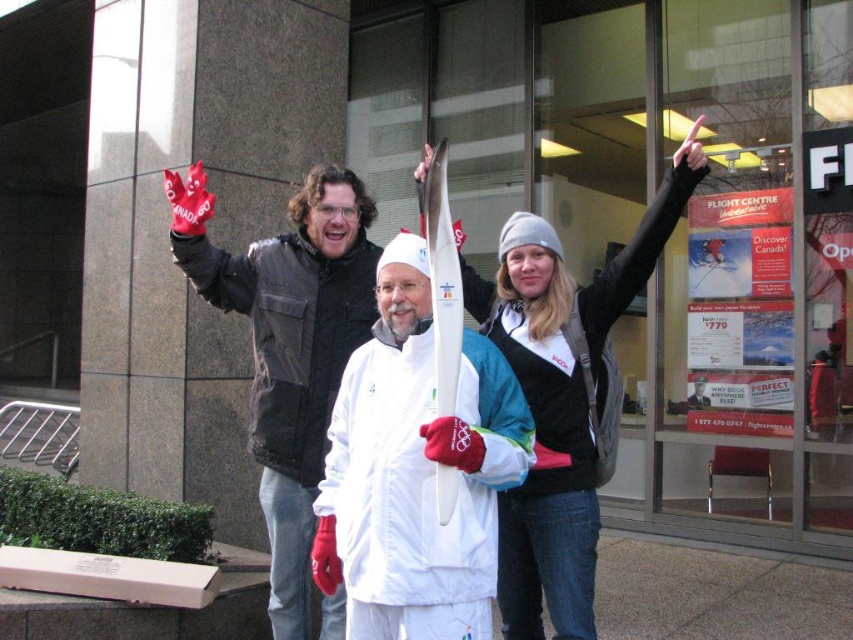
Question: Can you confirm if white matte ski at center is positioned to the left of matte black jacket at left?

Choices:
 (A) yes
 (B) no

Answer: (B)

Question: Which object is the closest to the white matte ski at center?

Choices:
 (A) matte black jacket at left
 (B) white woolen hat at upper center

Answer: (B)

Question: Is white woolen hat at upper center below matte black jacket at left?

Choices:
 (A) no
 (B) yes

Answer: (A)

Question: Can you confirm if white matte ski at center is wider than matte black jacket at left?

Choices:
 (A) no
 (B) yes

Answer: (A)

Question: Which point is farther to the camera?

Choices:
 (A) matte black jacket at left
 (B) white matte ski at center
 (C) white woolen hat at upper center

Answer: (A)

Question: Which of the following is the farthest from the observer?

Choices:
 (A) (289, 472)
 (B) (515, 588)

Answer: (A)